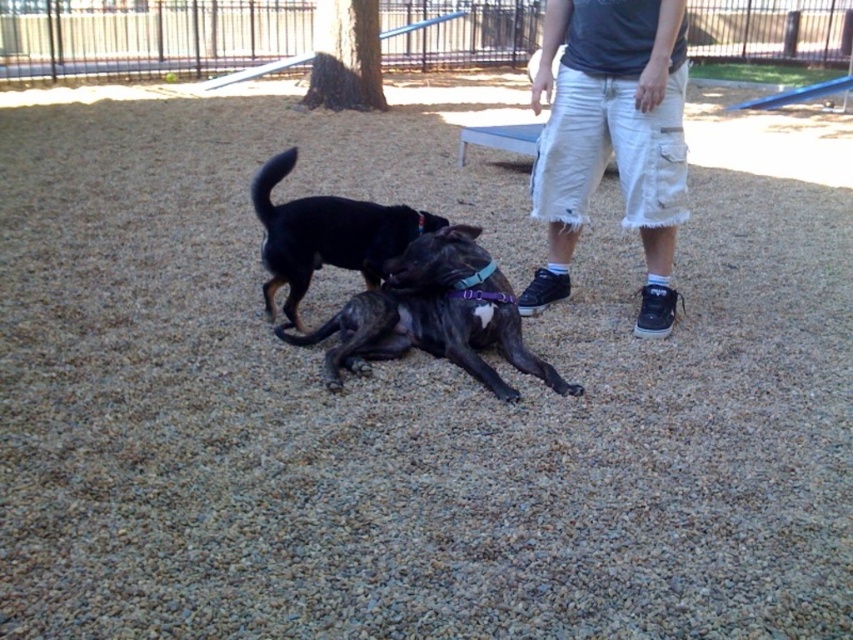
Between brindle fur dog at center and black matte dog at center, which one has more height?

black matte dog at center is taller.

Between point (480, 330) and point (281, 259), which one is positioned behind?

Point (281, 259)

Does point (461, 364) come closer to viewer compared to point (320, 241)?

Yes, it is.

I want to click on brindle fur dog at center, so click(x=434, y=316).

Does white cotton shorts at right lie behind brindle fur dog at center?

Yes, white cotton shorts at right is behind brindle fur dog at center.

Looking at this image, is white cotton shorts at right closer to camera compared to brindle fur dog at center?

No, it is behind brindle fur dog at center.

Does point (619, 76) come behind point (425, 333)?

Yes.

Identify the location of white cotton shorts at right. pyautogui.click(x=612, y=138).

Which is in front, point (630, 32) or point (308, 282)?

Point (630, 32) is in front.

Which is behind, point (555, 172) or point (293, 262)?

The point (555, 172) is behind.

Which is behind, point (601, 70) or point (357, 230)?

The point (601, 70) is more distant.

The height and width of the screenshot is (640, 853). I want to click on white cotton shorts at right, so click(x=612, y=138).